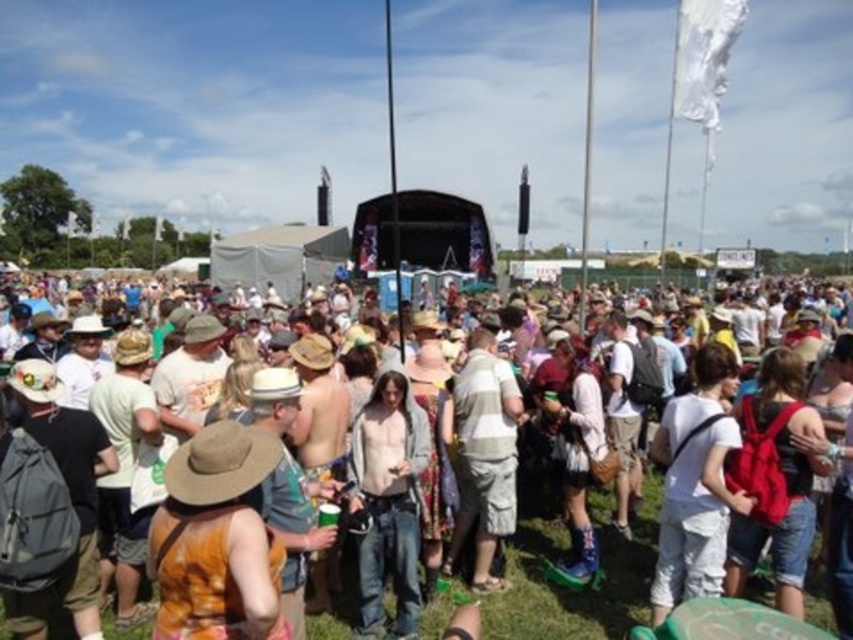
Question: Does matte white tent at center have a larger size compared to brown straw cowboy hat at center?

Choices:
 (A) yes
 (B) no

Answer: (A)

Question: Does matte white tent at center have a larger size compared to brown straw cowboy hat at center?

Choices:
 (A) no
 (B) yes

Answer: (B)

Question: Can you confirm if matte white tent at center is positioned above brown straw cowboy hat at center?

Choices:
 (A) no
 (B) yes

Answer: (A)

Question: Among these points, which one is farthest from the camera?

Choices:
 (A) (229, 424)
 (B) (103, 620)

Answer: (B)